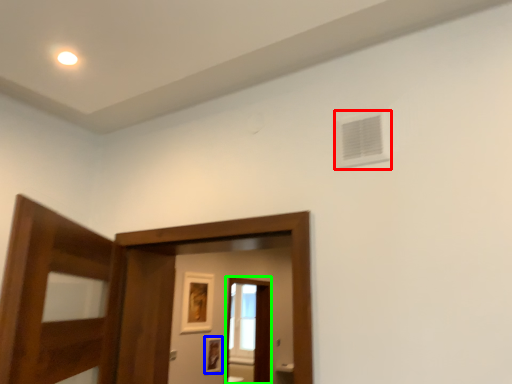
Question: Based on their relative distances, which object is nearer to air conditioning (highlighted by a red box)? Choose from picture frame (highlighted by a blue box) and screen door (highlighted by a green box).

Choices:
 (A) picture frame
 (B) screen door

Answer: (A)